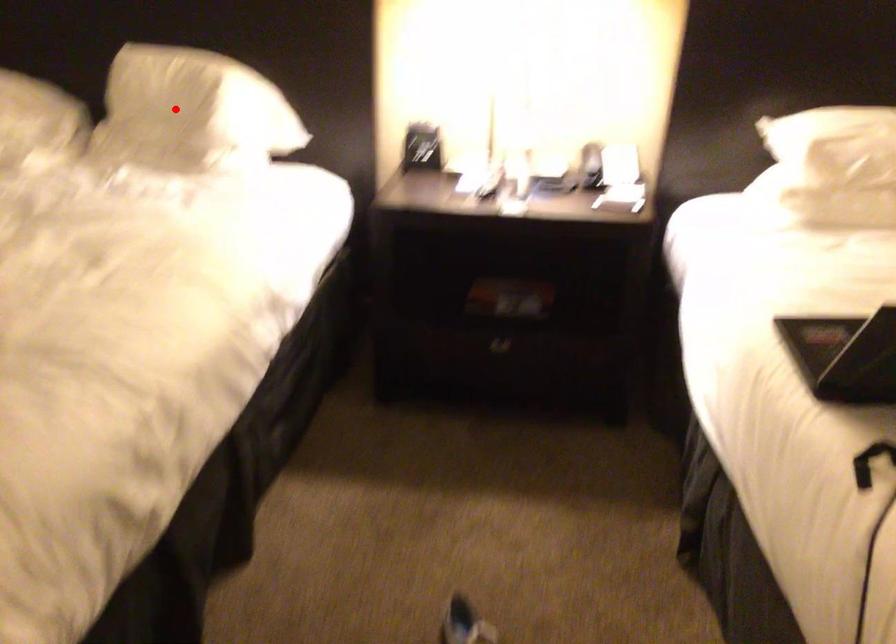
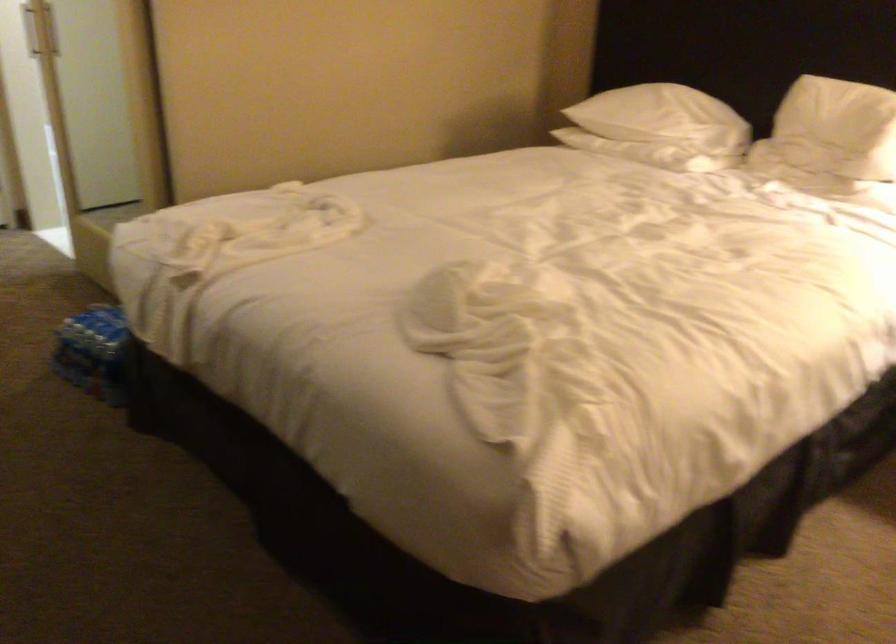
Locate, in the second image, the point that corresponds to the highlighted location in the first image.

(837, 128)